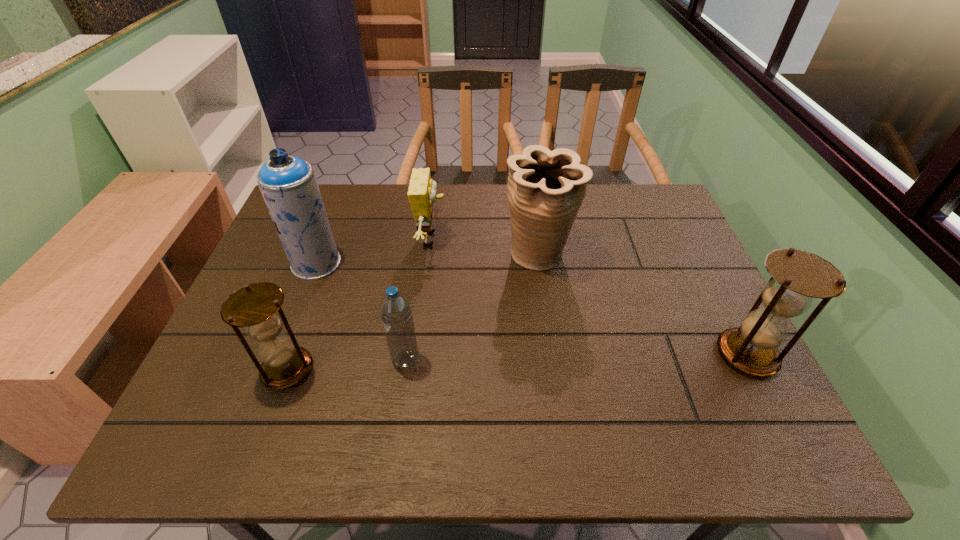
This screenshot has width=960, height=540. What are the coordinates of `vacant space that satisfies the following two spatial constraints: 1. on the back side of the left hourglass; 2. on the right side of the water bottle` in the screenshot? It's located at (291, 360).

Image resolution: width=960 pixels, height=540 pixels. Find the location of `vacant space that satisfies the following two spatial constraints: 1. on the front side of the rightmost object; 2. on the right side of the aerosol can`. vacant space that satisfies the following two spatial constraints: 1. on the front side of the rightmost object; 2. on the right side of the aerosol can is located at coordinates (281, 354).

You are a GUI agent. You are given a task and a screenshot of the screen. Output one action in this format:
    pyautogui.click(x=<x>, y=<y>)
    Task: Click on the vacant space that satisfies the following two spatial constraints: 1. on the front side of the taller hourglass; 2. on the left side of the fifth object from left to right
    
    Given the screenshot: What is the action you would take?
    click(x=552, y=354)

Where is `free space that satisfies the following two spatial constraints: 1. on the face of the sponge; 2. on the front side of the tallest object`? free space that satisfies the following two spatial constraints: 1. on the face of the sponge; 2. on the front side of the tallest object is located at coordinates (429, 264).

The width and height of the screenshot is (960, 540). In order to click on free space that satisfies the following two spatial constraints: 1. on the back side of the second object from right to left; 2. on the face of the sponge in this screenshot , I will do `click(537, 239)`.

The image size is (960, 540). What are the coordinates of `vacant area in the image that satisfies the following two spatial constraints: 1. on the face of the sponge; 2. on the front side of the water bottle` in the screenshot? It's located at (418, 360).